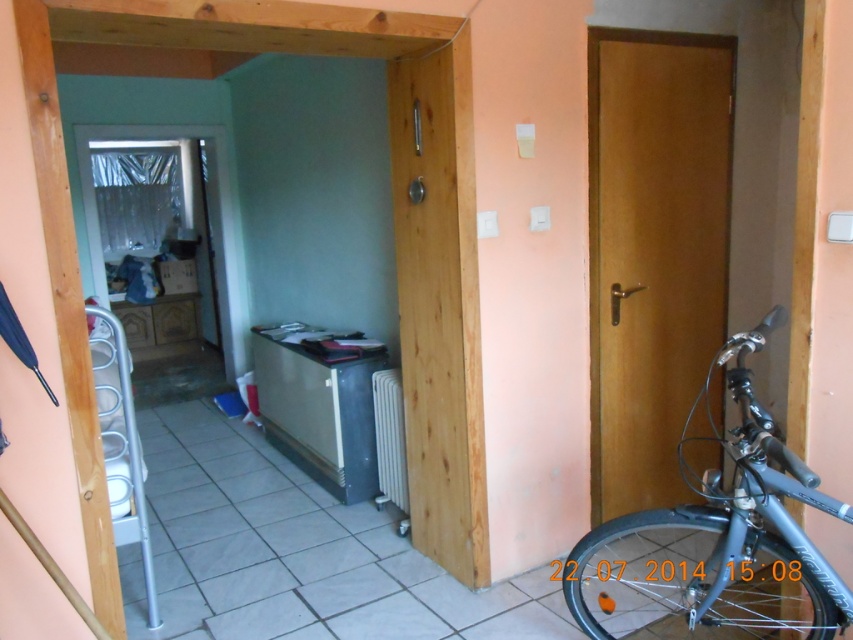
The image size is (853, 640). What are the coordinates of `silver metallic bicycle at right` in the screenshot? It's located at (717, 544).

Does silver metallic bicycle at right have a greater width compared to wooden door at center?

Correct, the width of silver metallic bicycle at right exceeds that of wooden door at center.

At what (x,y) coordinates should I click in order to perform the action: click on silver metallic bicycle at right. Please return your answer as a coordinate pair (x, y). Looking at the image, I should click on (717, 544).

Is wooden door at right above silver metallic bicycle at right?

Indeed, wooden door at right is positioned over silver metallic bicycle at right.

Between wooden door at right and silver metallic bicycle at right, which one appears on the left side from the viewer's perspective?

Positioned to the left is silver metallic bicycle at right.

Locate an element on the screen. Image resolution: width=853 pixels, height=640 pixels. wooden door at right is located at coordinates (653, 250).

Find the location of a particular element. The width and height of the screenshot is (853, 640). wooden door at right is located at coordinates (653, 250).

Does wooden door at right have a greater height compared to wooden door at center?

Correct, wooden door at right is much taller as wooden door at center.

Is wooden door at right closer to the viewer compared to wooden door at center?

No.

Identify the location of wooden door at right. (x=653, y=250).

The width and height of the screenshot is (853, 640). What are the coordinates of `wooden door at right` in the screenshot? It's located at (653, 250).